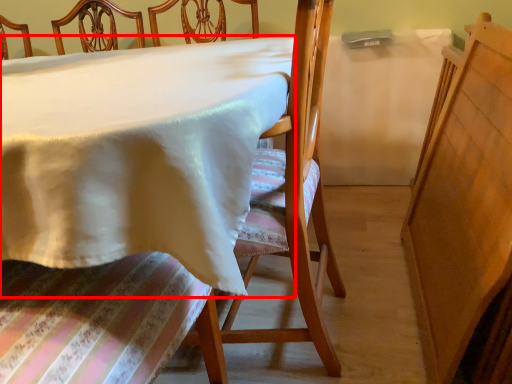
Question: Observing the image, what is the correct spatial positioning of table (annotated by the red box) in reference to chair?

Choices:
 (A) left
 (B) right

Answer: (A)